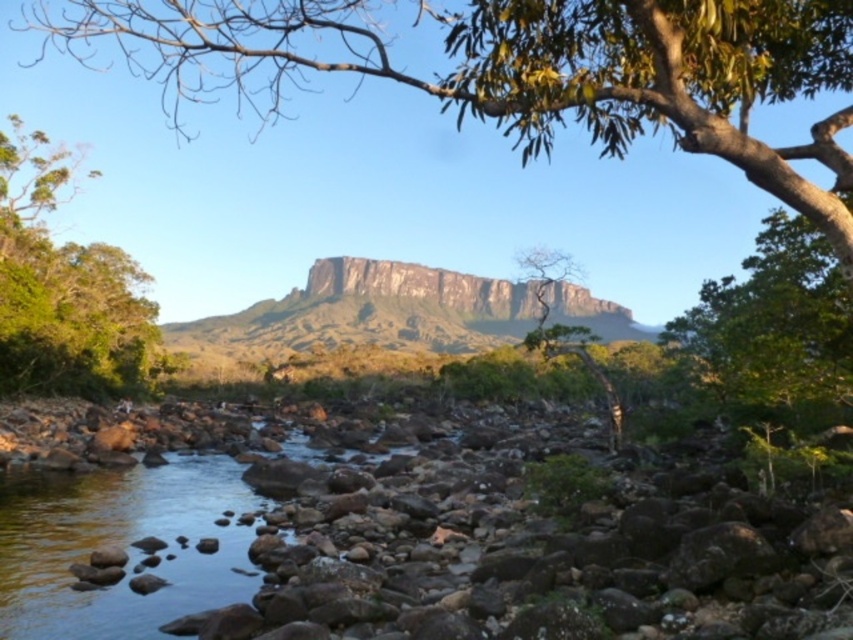
You are planning to set up a tent for camping. You have two options for the location based on the image. The first is near the green leafy tree at left, and the second is near the brown rocky mountain at center. Considering the space required for a standard tent, which location would provide more room for the tent?

The brown rocky mountain at center is thicker than the green leafy tree at left, so the area near the brown rocky mountain at center would likely offer more space for setting up a standard tent.

You are planning to cross the river using the rocks in the riverbed. The brown rocky mountain at center and the green leafy tree at center are visible from where you stand. Which object should you avoid stepping on to stay dry?

You should avoid stepping on the brown rocky mountain at center because it is bigger than the green leafy tree at center, so it might be higher and drier.